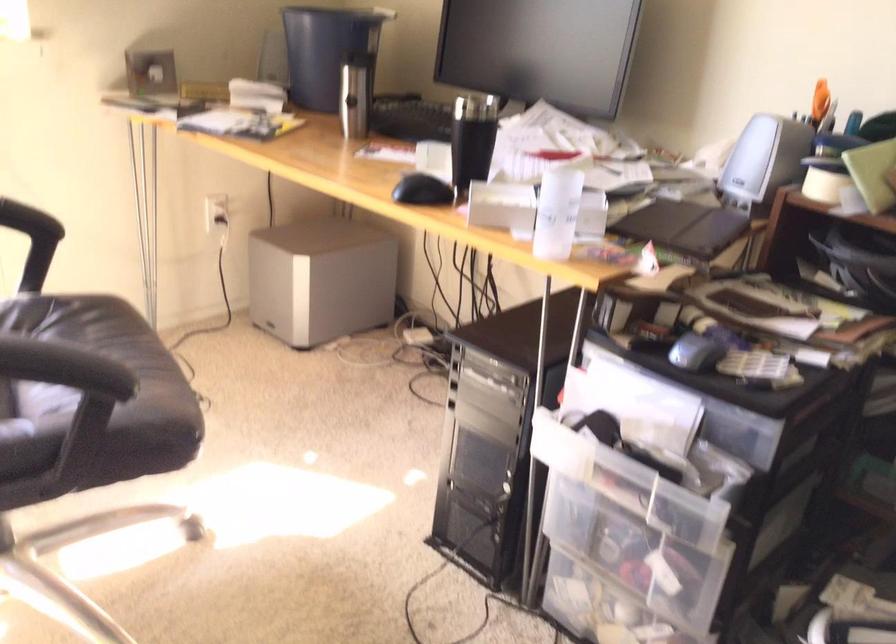
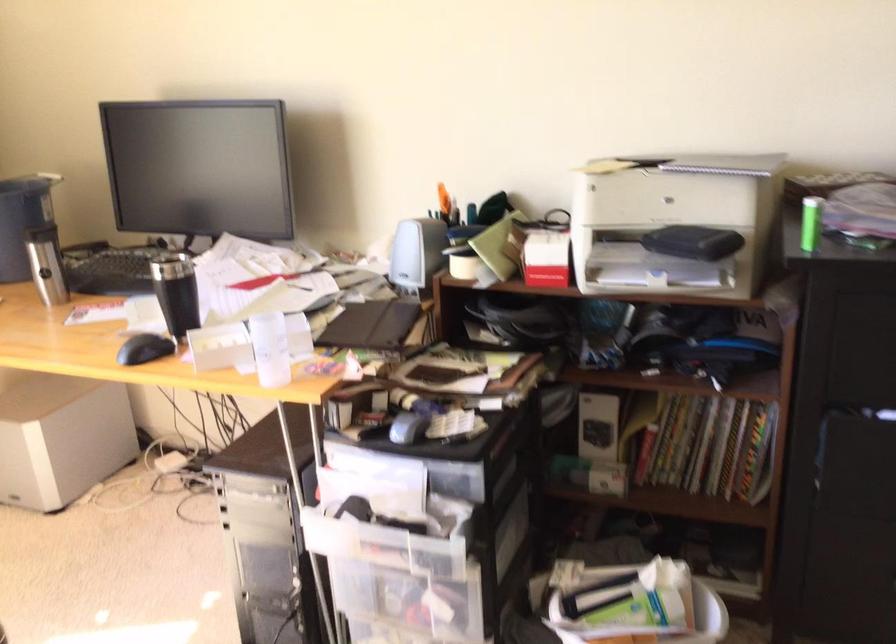
Where in the second image is the point corresponding to pixel 619 486 from the first image?

(383, 545)